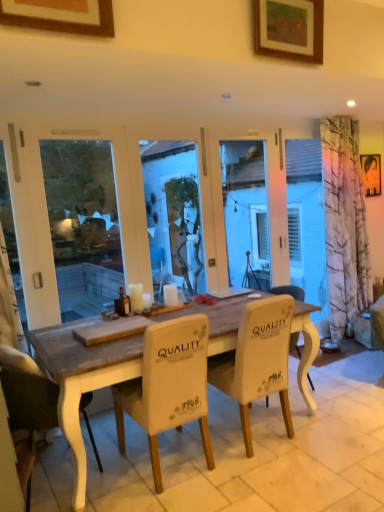
This screenshot has height=512, width=384. What are the coordinates of `vacant point to the right of white fabric chair at center, the 2th chair when ordered from right to left` in the screenshot? It's located at (257, 479).